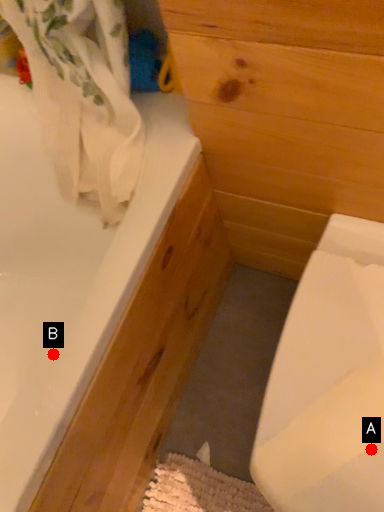
Question: Two points are circled on the image, labeled by A and B beside each circle. Which point is closer to the camera taking this photo?

Choices:
 (A) A is closer
 (B) B is closer

Answer: (A)